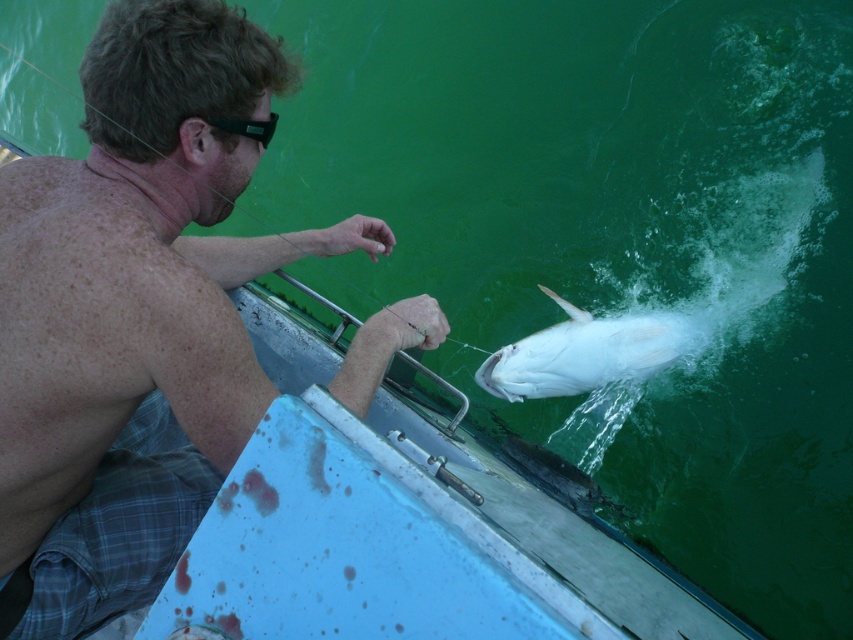
Is the position of shiny skin man at upper left less distant than that of white glossy fish at lower center?

That is True.

Can you confirm if shiny skin man at upper left is bigger than white glossy fish at lower center?

Indeed, shiny skin man at upper left has a larger size compared to white glossy fish at lower center.

Which is in front, point (83, 529) or point (585, 365)?

Point (83, 529) is in front.

What are the coordinates of `shiny skin man at upper left` in the screenshot? It's located at (134, 314).

Does point (657, 330) lie behind point (260, 128)?

Yes, it is behind point (260, 128).

Which is below, white glossy fish at lower center or black plastic goggles at upper left?

white glossy fish at lower center is below.

Who is more forward, (677, 317) or (207, 116)?

Point (207, 116) is more forward.

Where is `white glossy fish at lower center`? The image size is (853, 640). white glossy fish at lower center is located at coordinates (581, 353).

Is point (84, 211) positioned before point (248, 122)?

Yes, it is.

Does shiny skin man at upper left have a greater width compared to black plastic goggles at upper left?

Yes.

Does point (28, 272) come farther from viewer compared to point (238, 125)?

No, it is not.

Where is `shiny skin man at upper left`? The image size is (853, 640). shiny skin man at upper left is located at coordinates (134, 314).